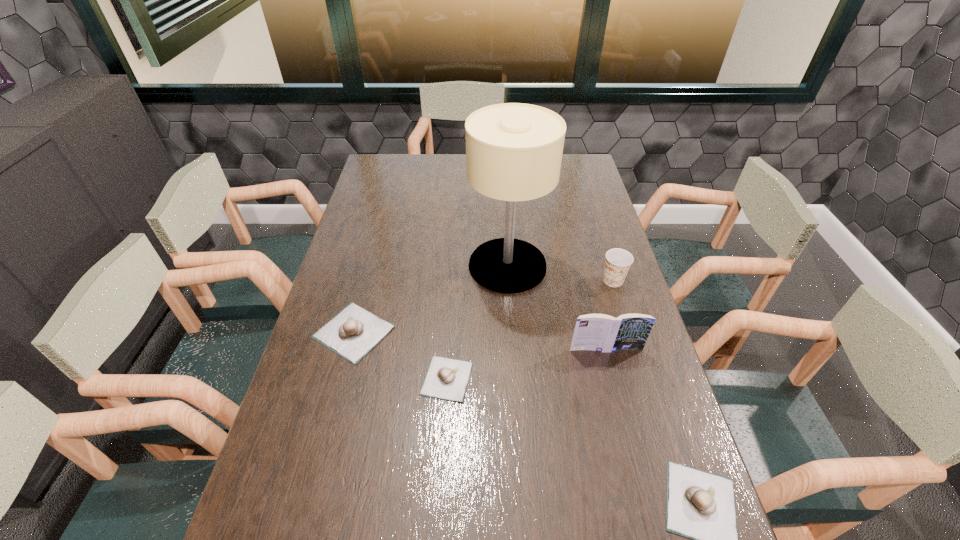
In order to click on free spot located 0.340m on the front of the tallest object in this screenshot , I will do `click(516, 392)`.

Locate an element on the screen. This screenshot has width=960, height=540. object that is at the left edge is located at coordinates (353, 332).

Find the location of a particular element. The image size is (960, 540). book that is at the right edge is located at coordinates (598, 332).

In order to click on Dixie cup situated at the right edge in this screenshot , I will do `click(618, 261)`.

The width and height of the screenshot is (960, 540). What are the coordinates of `blank area at the left edge` in the screenshot? It's located at (350, 239).

The image size is (960, 540). I want to click on vacant space at the right edge of the desktop, so click(x=654, y=377).

Find the location of a particular element. The image size is (960, 540). vacant area at the far right corner is located at coordinates (584, 176).

Locate an element on the screen. free area in between the Dixie cup and the leftmost object is located at coordinates (483, 306).

At what (x,y) coordinates should I click in order to perform the action: click on free space between the tallest object and the fifth shortest object. Please return your answer as a coordinate pair (x, y). This screenshot has height=540, width=960. Looking at the image, I should click on (557, 307).

What are the coordinates of `free space between the Dixie cup and the second tallest object` in the screenshot? It's located at (610, 315).